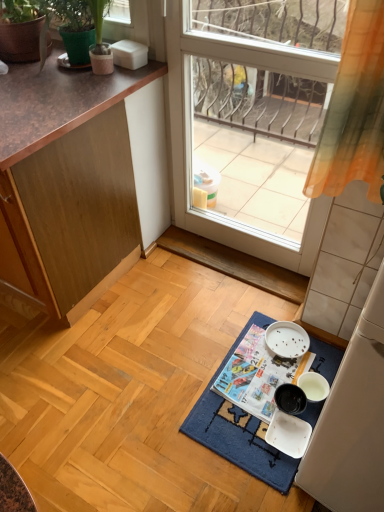
This screenshot has width=384, height=512. Find the location of `free space in front of green matte flowerpot at upper left`. free space in front of green matte flowerpot at upper left is located at coordinates (23, 75).